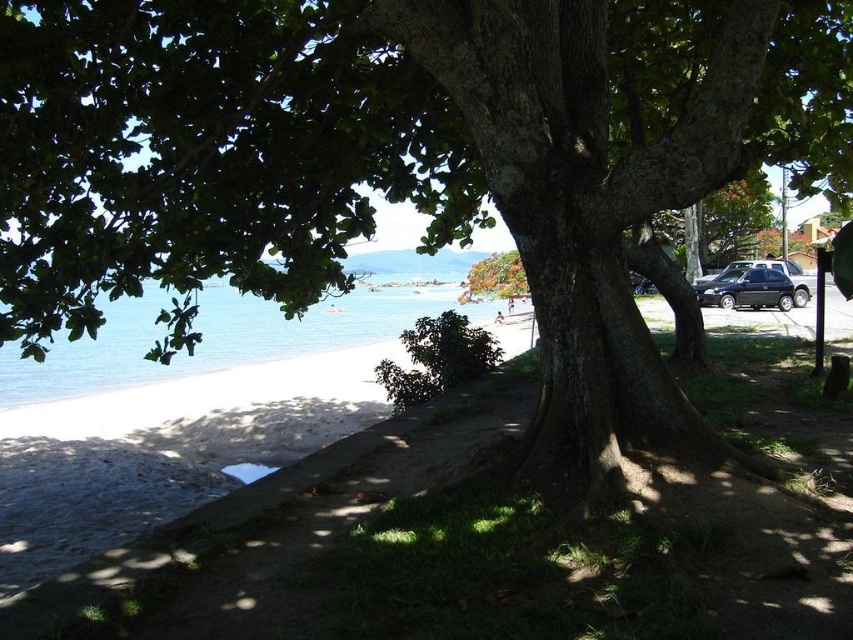
Does clear blue water at lower left have a greater height compared to black matte car at right?

Indeed, clear blue water at lower left has a greater height compared to black matte car at right.

Can you confirm if clear blue water at lower left is bigger than black matte car at right?

Correct, clear blue water at lower left is larger in size than black matte car at right.

Locate an element on the screen. clear blue water at lower left is located at coordinates (222, 337).

Find the location of a particular element. The image size is (853, 640). clear blue water at lower left is located at coordinates (222, 337).